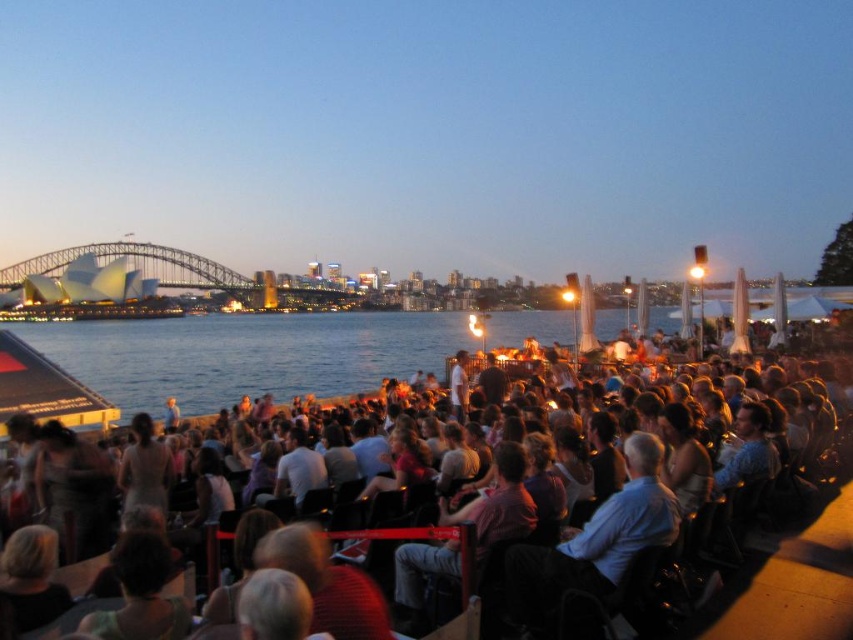
Who is higher up, dark blue water at center or matte black chairs at center?

dark blue water at center is above.

Is dark blue water at center below matte black chairs at center?

Incorrect, dark blue water at center is not positioned below matte black chairs at center.

Is point (461, 321) less distant than point (42, 419)?

No, (461, 321) is behind (42, 419).

In order to click on dark blue water at center in this screenshot , I will do `click(245, 355)`.